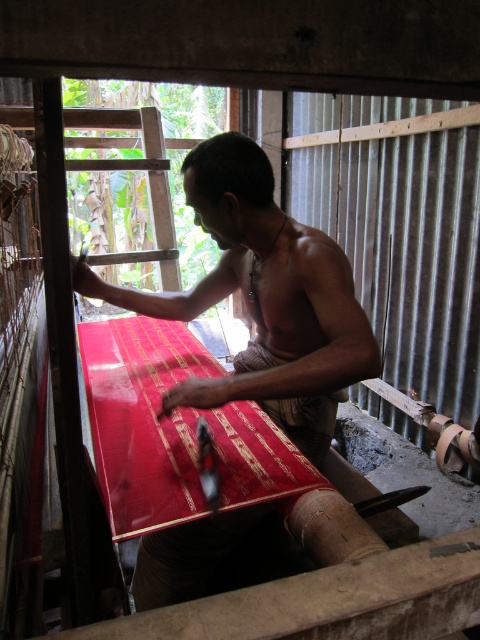
Does shiny red fabric at center come behind red silk fabric at center?

No.

Who is shorter, shiny red fabric at center or red silk fabric at center?

Standing shorter between the two is red silk fabric at center.

Which is in front, point (169, 364) or point (328, 424)?

Positioned in front is point (328, 424).

Locate an element on the screen. Image resolution: width=480 pixels, height=640 pixels. shiny red fabric at center is located at coordinates (173, 429).

In the scene shown: Between smooth red fabric at center and shiny red fabric at center, which one has more height?

smooth red fabric at center

Does point (328, 250) come behind point (155, 371)?

No.

At what (x,y) coordinates should I click in order to perform the action: click on smooth red fabric at center. Please return your answer as a coordinate pair (x, y). Image resolution: width=480 pixels, height=640 pixels. Looking at the image, I should click on tap(264, 298).

Can you confirm if smooth red fabric at center is positioned to the left of red silk fabric at center?

Yes, smooth red fabric at center is to the left of red silk fabric at center.

Does smooth red fabric at center have a lesser height compared to red silk fabric at center?

No.

I want to click on smooth red fabric at center, so click(x=264, y=298).